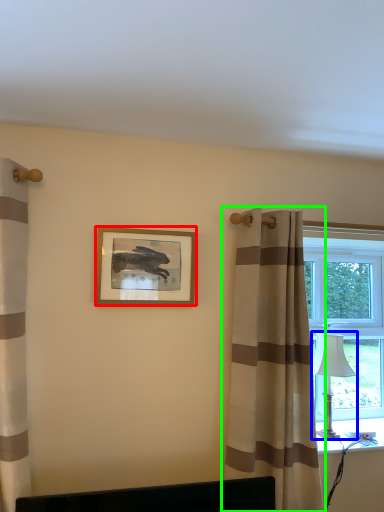
Question: Which is farther away from picture frame (highlighted by a red box)? table lamp (highlighted by a blue box) or curtain (highlighted by a green box)?

Choices:
 (A) table lamp
 (B) curtain

Answer: (A)